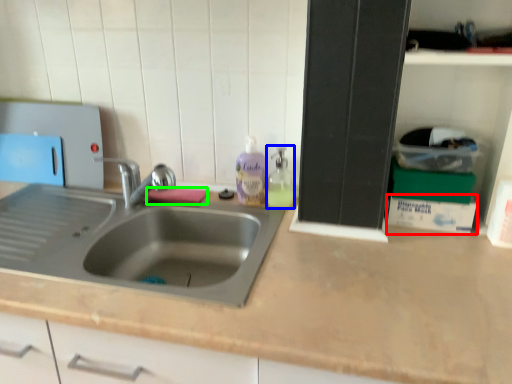
Question: Based on their relative distances, which object is farther from box (highlighted by a red box)? Choose from soap dispenser (highlighted by a blue box) and soap (highlighted by a green box).

Choices:
 (A) soap dispenser
 (B) soap

Answer: (B)